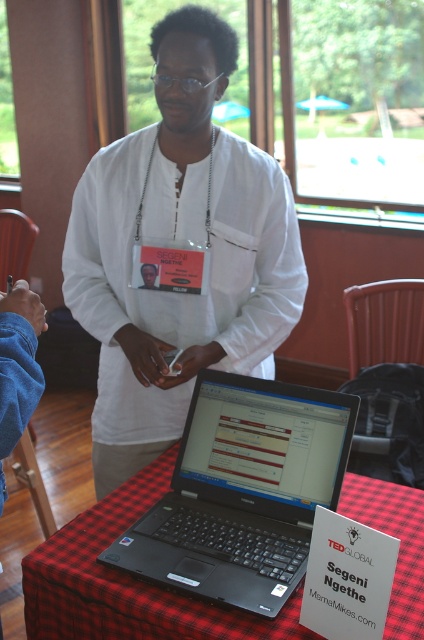
Question: Is red plaid tablecloth at lower center positioned before matte white id card at center?

Choices:
 (A) no
 (B) yes

Answer: (B)

Question: From the image, what is the correct spatial relationship of black plastic laptop at center in relation to matte white id card at center?

Choices:
 (A) left
 (B) right

Answer: (B)

Question: Which point is farther to the camera?

Choices:
 (A) black plastic laptop at center
 (B) white matte shirt at center
 (C) matte white id card at center
 (D) red plaid tablecloth at lower center

Answer: (C)

Question: Among these points, which one is nearest to the camera?

Choices:
 (A) (156, 550)
 (B) (151, 280)
 (C) (89, 528)

Answer: (A)

Question: Estimate the real-world distances between objects in this image. Which object is farther from the black plastic laptop at center?

Choices:
 (A) red plaid tablecloth at lower center
 (B) white matte shirt at center

Answer: (B)

Question: Is white matte shirt at center wider than red plaid tablecloth at lower center?

Choices:
 (A) yes
 (B) no

Answer: (B)